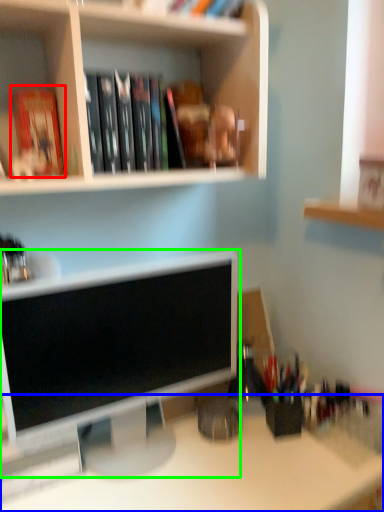
Question: Which is farther away from paperback book (highlighted by a red box)? desk (highlighted by a blue box) or computer monitor (highlighted by a green box)?

Choices:
 (A) desk
 (B) computer monitor

Answer: (A)